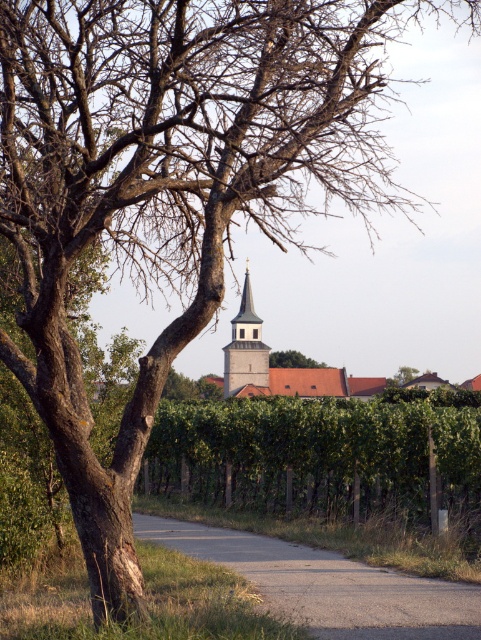
You are standing at the base of the tree on the left side of the frame. You want to walk to the light gray stone tower at center. Which direction should you head to avoid the asphalt road at center?

To avoid the asphalt road at center, you should head to the left side of the light gray stone tower at center since the asphalt road at center is to the right of the tower.

You are standing at the base of the tree on the left side of the frame. You want to walk to the light gray stone tower at center. How far will you have to walk along the asphalt road at center to reach it?

The asphalt road at center is 84.00 meters from the light gray stone tower at center, so you will have to walk 84.00 meters along the asphalt road at center to reach it.

You are standing at the point labeled point (x=354, y=612) and want to walk towards the point labeled point (x=279, y=364). Since both points are on the path leading to the buildings, will you be moving towards or away from the camera as you walk?

As you walk from point (x=354, y=612) to point (x=279, y=364), you will be moving away from the camera because point (x=279, y=364) is further away from the camera compared to point (x=354, y=612).